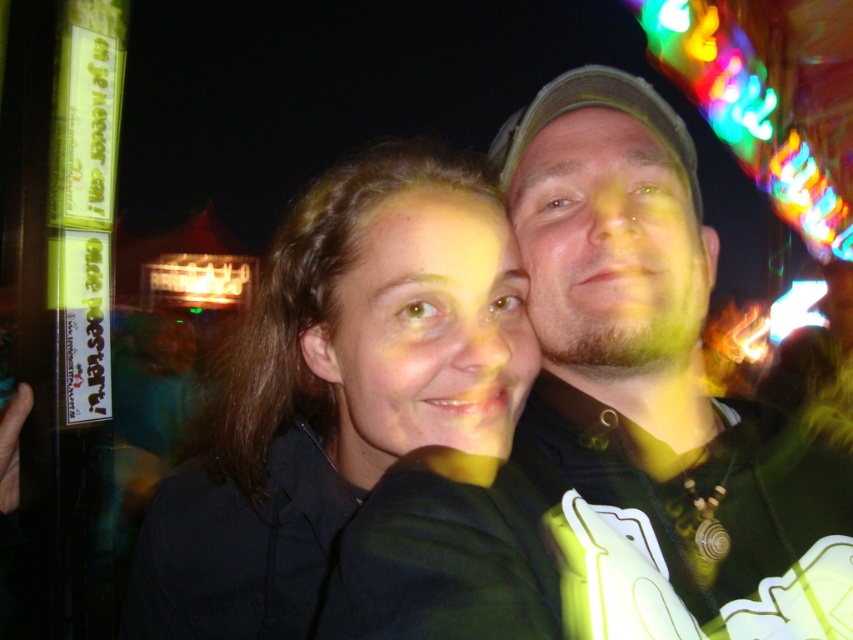
You are standing in front of a photo of two people at a nighttime event with colorful lights. The photo has a person on the left wearing a dark jacket and a person on the right wearing a cap and a dark shirt with light designs. There is a point marked at coordinates (654, 388). What object in the photo corresponds to this point?

The point at (654, 388) corresponds to the matte black hoodie at center.

You are at a festival and want to take a photo of the dark brown hair at center and the matte black hoodie at center. Since you can only focus on one object at a time, which one should you focus on to ensure the other is in the background?

You should focus on the matte black hoodie at center because it is to the right of dark brown hair at center, so dark brown hair at center will be in the background.

You are a photographer trying to adjust the focus of your camera. You want to ensure that both the matte black hoodie at center and the dark brown hair at center are in focus. Given their sizes in the image, which object should you prioritize focusing on first to ensure clarity?

The matte black hoodie at center is smaller than dark brown hair at center. Since smaller objects may require more precise focusing, you should prioritize focusing on the matte black hoodie at center first to ensure clarity.